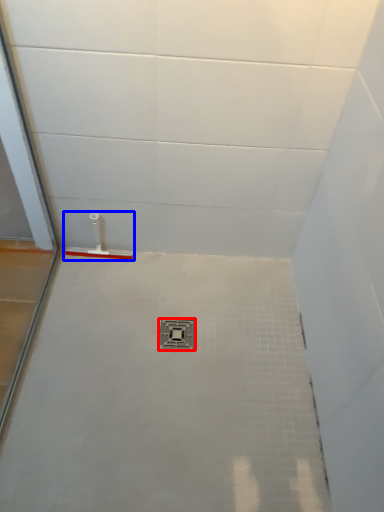
Question: Which of the following is the closest to the observer, plumbing fixture (highlighted by a red box) or shower (highlighted by a blue box)?

Choices:
 (A) plumbing fixture
 (B) shower

Answer: (A)